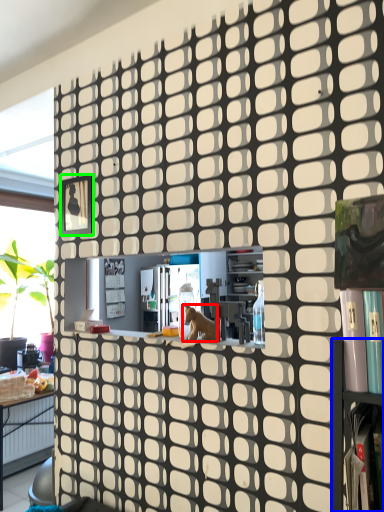
Question: Which is nearer to the animal (highlighted by a red box)? shelf (highlighted by a blue box) or square (highlighted by a green box).

Choices:
 (A) shelf
 (B) square

Answer: (A)